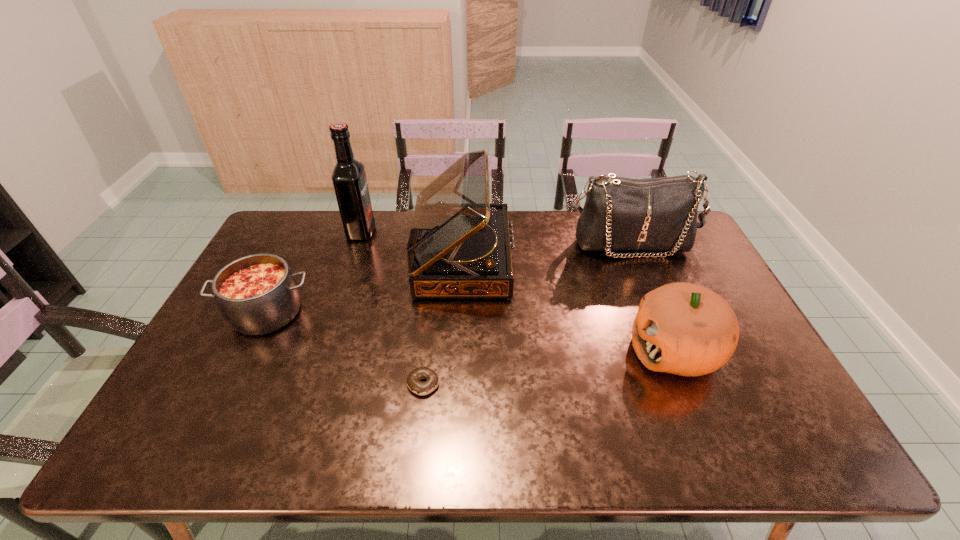
I want to click on vacant space in between the third shortest object and the casserole, so (x=470, y=332).

Identify the location of vacant area that lies between the leftmost object and the liquor. The width and height of the screenshot is (960, 540). (314, 272).

This screenshot has width=960, height=540. Find the location of `free space between the leftmost object and the record player`. free space between the leftmost object and the record player is located at coordinates (365, 285).

What are the coordinates of `free space between the shortest object and the record player` in the screenshot? It's located at (444, 321).

Locate an element on the screen. The width and height of the screenshot is (960, 540). unoccupied area between the shortest object and the record player is located at coordinates (444, 321).

Locate an element on the screen. vacant area that lies between the handbag and the shortest object is located at coordinates point(526,314).

Select which object is the fifth closest to the casserole. Please provide its 2D coordinates. Your answer should be formatted as a tuple, i.e. [(x, y)], where the tuple contains the x and y coordinates of a point satisfying the conditions above.

[(686, 329)]

At what (x,y) coordinates should I click in order to perform the action: click on object that stands as the third closest to the handbag. Please return your answer as a coordinate pair (x, y). The image size is (960, 540). Looking at the image, I should click on (414, 384).

I want to click on vacant space that satisfies the following two spatial constraints: 1. on the front-facing side of the liquor; 2. on the front side of the casserole, so click(334, 313).

Where is `free space that satisfies the following two spatial constraints: 1. at the front of the handbag with chain and zipper; 2. on the front-facing side of the record player`? free space that satisfies the following two spatial constraints: 1. at the front of the handbag with chain and zipper; 2. on the front-facing side of the record player is located at coordinates (636, 258).